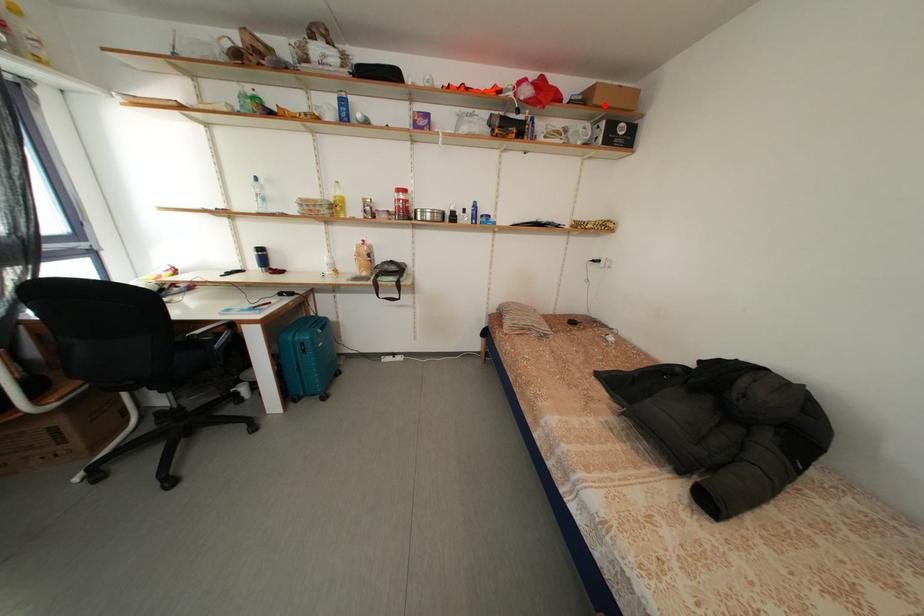
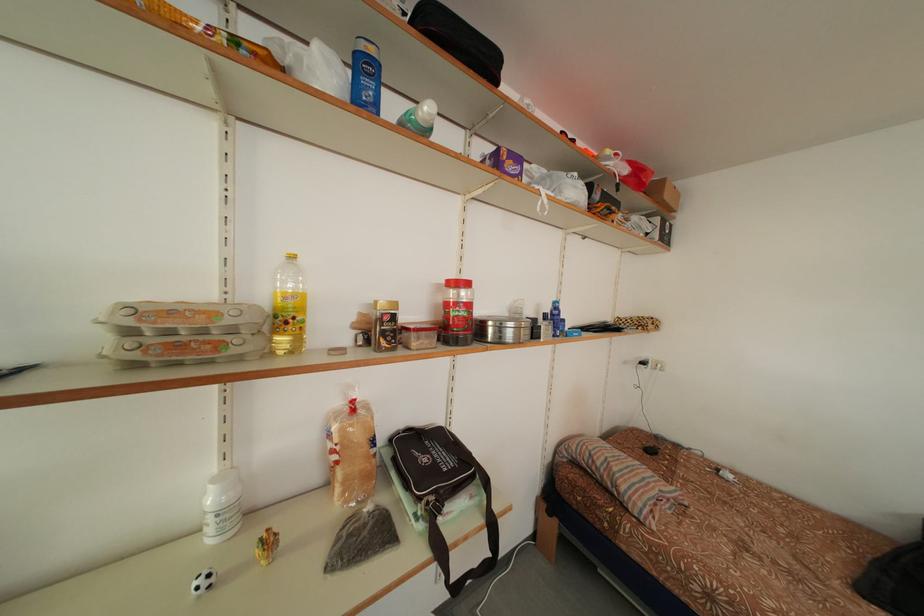
In the second image, find the point that corresponds to the highlighted location in the first image.

(675, 201)